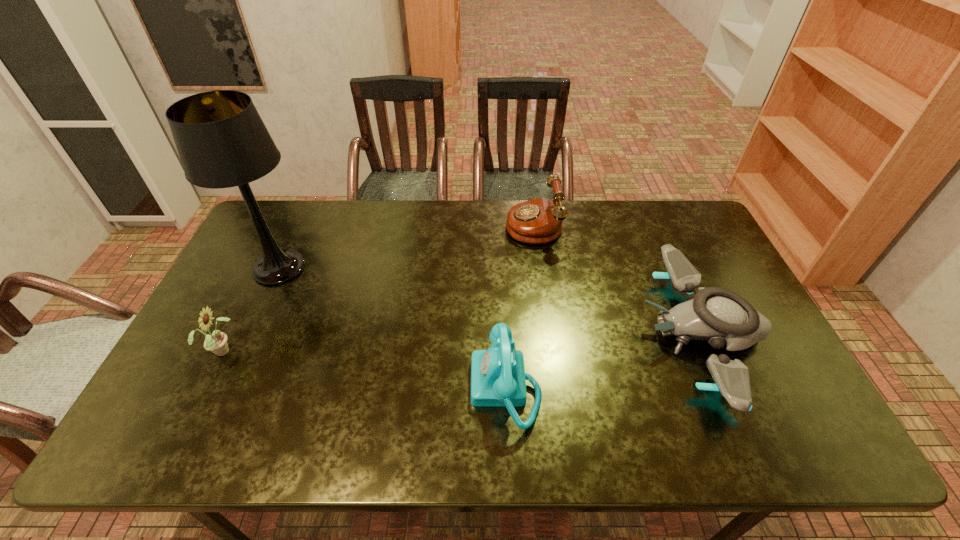
You are a GUI agent. You are given a task and a screenshot of the screen. Output one action in this format:
    pyautogui.click(x=<x>, y=<y>)
    Task: Click on the drone that is at the near edge
    The height and width of the screenshot is (540, 960).
    Given the screenshot: What is the action you would take?
    pyautogui.click(x=719, y=316)

The height and width of the screenshot is (540, 960). Find the location of `table lamp at the left edge`. table lamp at the left edge is located at coordinates pyautogui.click(x=222, y=142).

Where is `sunflower that is at the left edge`? The width and height of the screenshot is (960, 540). sunflower that is at the left edge is located at coordinates (216, 342).

Where is `object located in the right edge section of the desktop`? object located in the right edge section of the desktop is located at coordinates (719, 316).

Identify the location of object located in the near right corner section of the desktop. The width and height of the screenshot is (960, 540). (719, 316).

The image size is (960, 540). I want to click on vacant space at the far edge of the desktop, so click(311, 233).

The height and width of the screenshot is (540, 960). What are the coordinates of `free space at the left edge of the desktop` in the screenshot? It's located at (228, 310).

Find the location of a particular element. free space at the right edge of the desktop is located at coordinates (708, 287).

Locate an element on the screen. The width and height of the screenshot is (960, 540). vacant space at the far left corner of the desktop is located at coordinates (256, 235).

Where is `free space at the far right corner`? The height and width of the screenshot is (540, 960). free space at the far right corner is located at coordinates (677, 239).